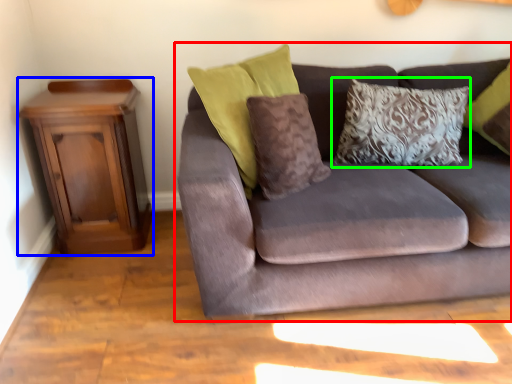
Question: Which object is the farthest from studio couch (highlighted by a red box)? Choose among these: nightstand (highlighted by a blue box) or pillow (highlighted by a green box).

Choices:
 (A) nightstand
 (B) pillow

Answer: (A)